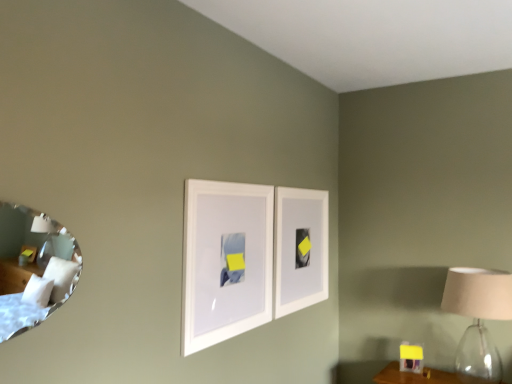
Question: From a real-world perspective, is white matte picture frame at center, marked as the first picture frame in a left-to-right arrangement, located beneath white matte picture frame at center, acting as the second picture frame starting from the front?

Choices:
 (A) yes
 (B) no

Answer: (A)

Question: Does white matte picture frame at center, which is counted as the 2th picture frame, starting from the right, have a smaller size compared to white matte picture frame at center, acting as the second picture frame starting from the front?

Choices:
 (A) no
 (B) yes

Answer: (B)

Question: Can you confirm if white matte picture frame at center, which is counted as the 2th picture frame, starting from the right, is thinner than white matte picture frame at center, the 1th picture frame from the back?

Choices:
 (A) no
 (B) yes

Answer: (B)

Question: Can you confirm if white matte picture frame at center, marked as the first picture frame in a left-to-right arrangement, is wider than white matte picture frame at center, the 1th picture frame from the back?

Choices:
 (A) no
 (B) yes

Answer: (A)

Question: Considering the relative sizes of white matte picture frame at center, which is counted as the 2th picture frame, starting from the right, and white matte picture frame at center, the 2th picture frame in the left-to-right sequence, in the image provided, is white matte picture frame at center, which is counted as the 2th picture frame, starting from the right, shorter than white matte picture frame at center, the 2th picture frame in the left-to-right sequence,?

Choices:
 (A) no
 (B) yes

Answer: (B)

Question: In terms of width, does white matte picture frame at center, which is counted as the 2th picture frame, starting from the right, look wider or thinner when compared to matte beige lampshade at right?

Choices:
 (A) thin
 (B) wide

Answer: (A)

Question: Considering the positions of point (218, 281) and point (467, 296), is point (218, 281) closer or farther from the camera than point (467, 296)?

Choices:
 (A) closer
 (B) farther

Answer: (A)

Question: Relative to matte beige lampshade at right, is white matte picture frame at center, which appears as the second picture frame when viewed from the back, in front or behind?

Choices:
 (A) front
 (B) behind

Answer: (A)

Question: From a real-world perspective, is white matte picture frame at center, which is counted as the 2th picture frame, starting from the right, positioned above or below matte beige lampshade at right?

Choices:
 (A) below
 (B) above

Answer: (B)

Question: Based on their positions, is matte beige lampshade at right located to the left or right of silver reflective mirror at left?

Choices:
 (A) right
 (B) left

Answer: (A)

Question: From a real-world perspective, relative to silver reflective mirror at left, is matte beige lampshade at right vertically above or below?

Choices:
 (A) above
 (B) below

Answer: (B)

Question: Is matte beige lampshade at right in front of or behind silver reflective mirror at left in the image?

Choices:
 (A) behind
 (B) front

Answer: (A)

Question: Is matte beige lampshade at right taller or shorter than silver reflective mirror at left?

Choices:
 (A) tall
 (B) short

Answer: (A)

Question: Based on their sizes in the image, would you say white matte picture frame at center, which is counted as the 2th picture frame, starting from the right, is bigger or smaller than silver reflective mirror at left?

Choices:
 (A) small
 (B) big

Answer: (B)

Question: Is white matte picture frame at center, the first picture frame viewed from the front, in front of or behind silver reflective mirror at left in the image?

Choices:
 (A) front
 (B) behind

Answer: (B)